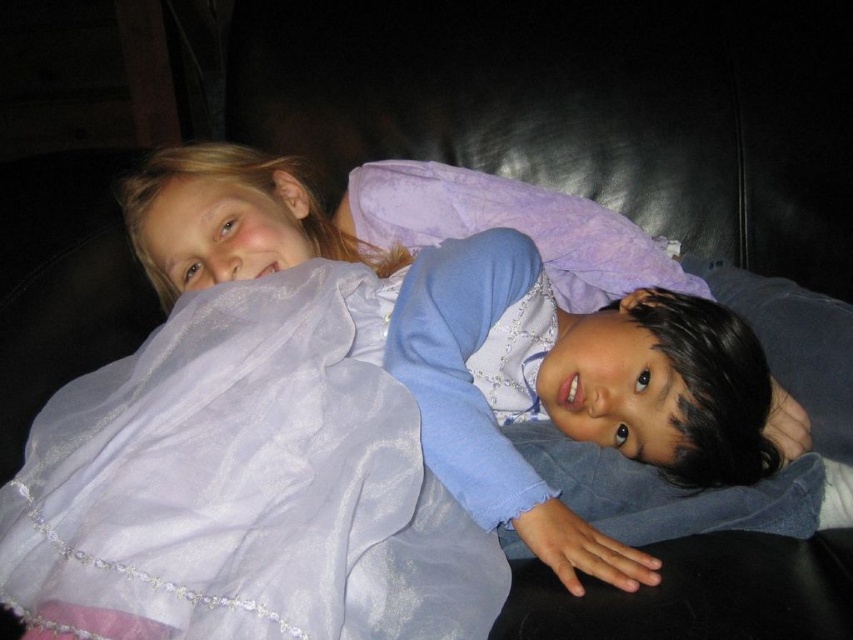
You are a fashion designer who wants to create a layered outfit using the matte purple dress at center and the translucent lavender fabric at center. Which item should you place underneath the other to ensure proper visibility of both layers?

A: The translucent lavender fabric at center should be placed over the matte purple dress at center since it is smaller and allows the dress to show through, creating a layered look while maintaining visibility of both items.